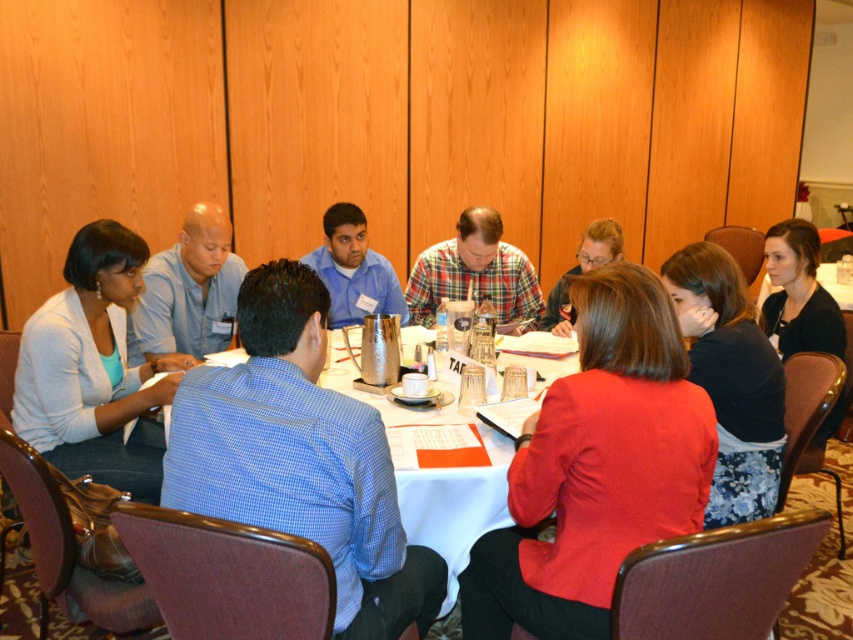
Question: Based on their relative distances, which object is nearer to the plaid fabric shirt at center?

Choices:
 (A) matte blue shirt at upper left
 (B) matte red blazer at center

Answer: (A)

Question: Can you confirm if matte red blazer at center is positioned to the right of plaid fabric shirt at center?

Choices:
 (A) no
 (B) yes

Answer: (B)

Question: Does plaid fabric shirt at center appear on the left side of blue shirt at center?

Choices:
 (A) yes
 (B) no

Answer: (B)

Question: Which point is farther to the camera?

Choices:
 (A) plaid fabric shirt at center
 (B) blue shirt at center

Answer: (B)

Question: Which of the following is the closest to the observer?

Choices:
 (A) matte blue shirt at upper left
 (B) matte red blazer at center
 (C) plaid fabric shirt at center
 (D) blue shirt at center

Answer: (B)

Question: From the image, what is the correct spatial relationship of white paper at center in relation to matte blue shirt at upper left?

Choices:
 (A) right
 (B) left

Answer: (A)